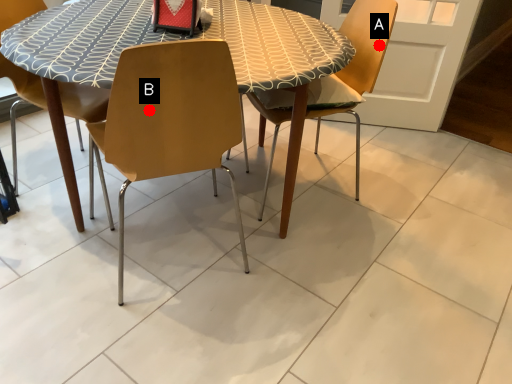
Question: Two points are circled on the image, labeled by A and B beside each circle. Which of the following is the closest to the observer?

Choices:
 (A) A is closer
 (B) B is closer

Answer: (B)